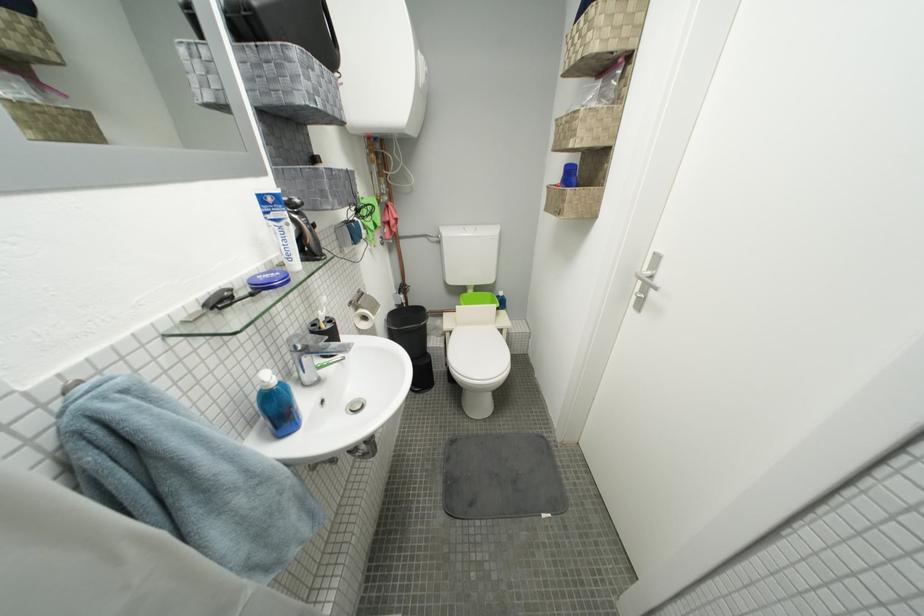
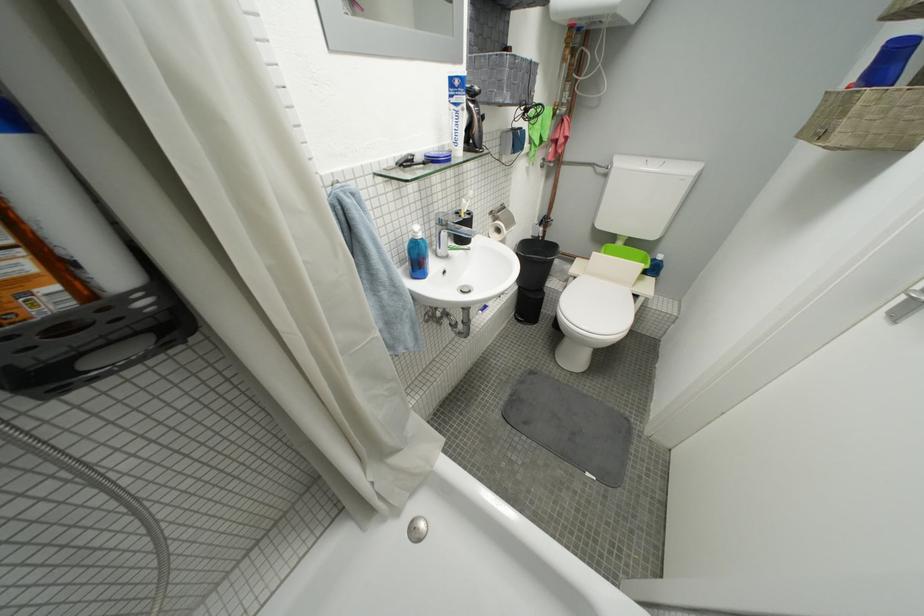
In the second image, find the point that corresponds to the point at 298,261 in the first image.

(465, 145)